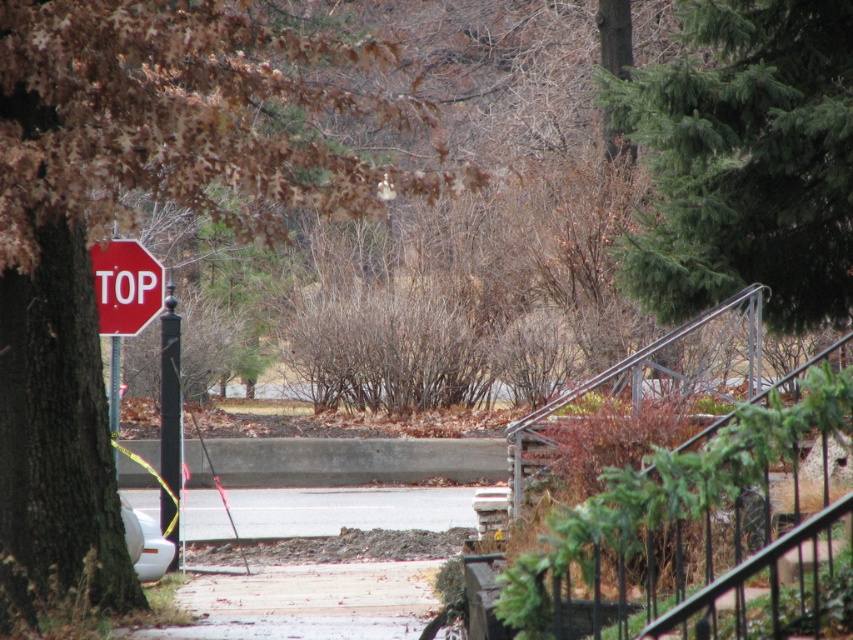
Is green textured evergreen tree at upper right shorter than black metal pole at left?

No, green textured evergreen tree at upper right is not shorter than black metal pole at left.

Who is more forward, (746,237) or (160,378)?

Point (746,237) is more forward.

The height and width of the screenshot is (640, 853). I want to click on green textured evergreen tree at upper right, so click(x=746, y=161).

This screenshot has width=853, height=640. I want to click on green textured evergreen tree at upper right, so click(746, 161).

Which is behind, point (335, 61) or point (831, 259)?

Positioned behind is point (831, 259).

Can you confirm if brown matte tree at upper left is positioned below green textured evergreen tree at upper right?

Yes, brown matte tree at upper left is below green textured evergreen tree at upper right.

At what (x,y) coordinates should I click in order to perform the action: click on brown matte tree at upper left. Please return your answer as a coordinate pair (x, y). Looking at the image, I should click on (131, 218).

Is point (86, 198) in front of point (117, 272)?

Yes, point (86, 198) is closer to viewer.

Can you confirm if brown matte tree at upper left is positioned to the left of red matte stop sign at left?

Incorrect, brown matte tree at upper left is not on the left side of red matte stop sign at left.

Does point (9, 67) come farther from viewer compared to point (115, 320)?

No, it is in front of (115, 320).

This screenshot has width=853, height=640. I want to click on brown matte tree at upper left, so click(131, 218).